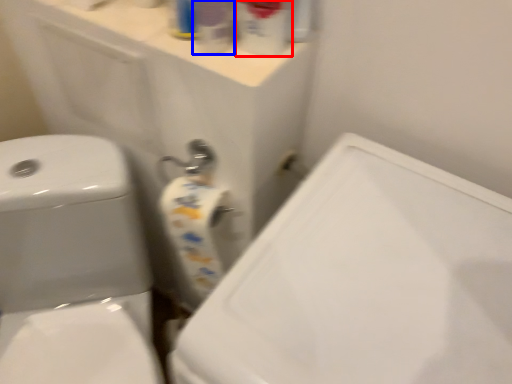
Question: Which object appears closest to the camera in this image, cleaning product (highlighted by a red box) or cleaning product (highlighted by a blue box)?

Choices:
 (A) cleaning product
 (B) cleaning product

Answer: (A)